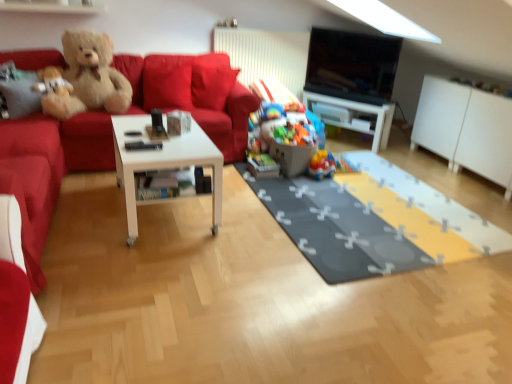
Describe the element at coordinates (466, 129) in the screenshot. I see `white matte cabinet at right` at that location.

Identify the location of velvet red couch at left. (57, 165).

Find the location of a particular element. matte red couch at left is located at coordinates (88, 142).

You are a GUI agent. You are given a task and a screenshot of the screen. Output one action in this format:
    pyautogui.click(x=<x>, y=<y>)
    Task: Click on the plastic colorful toys at center, marked as the second toy in a right-to-left arrangement
    Image resolution: width=512 pixels, height=384 pixels.
    Given the screenshot: What is the action you would take?
    pyautogui.click(x=293, y=147)

Identify the location of fluffy beige teddy bear at upper left, the 1th teddy bear in the left-to-right sequence. (57, 94).

What do you see at coordinates (374, 221) in the screenshot? I see `gray fabric mat at center` at bounding box center [374, 221].

Describe the element at coordinates (163, 163) in the screenshot. I see `white glossy coffee table at center` at that location.

Find the location of a particular element. The image size is (512, 384). white matte cabinet at right is located at coordinates (466, 129).

Considering the points (73, 143) and (42, 101), which point is behind, point (73, 143) or point (42, 101)?

Positioned behind is point (73, 143).

Which is more to the left, matte red couch at left or fluffy beige teddy bear at upper left, which is counted as the second teddy bear, starting from the right?

fluffy beige teddy bear at upper left, which is counted as the second teddy bear, starting from the right, is more to the left.

Is matte red couch at left oriented towards fluffy beige teddy bear at upper left, the 1th teddy bear in the left-to-right sequence?

No, matte red couch at left is not turned towards fluffy beige teddy bear at upper left, the 1th teddy bear in the left-to-right sequence.

Is fluffy beige teddy bear at upper left, which is counted as the second teddy bear, starting from the right, located within matte red couch at left?

Yes.

Considering the positions of objects white glossy coffee table at center and plastic colorful toys at center, marked as the second toy in a right-to-left arrangement, in the image provided, who is more to the right, white glossy coffee table at center or plastic colorful toys at center, marked as the second toy in a right-to-left arrangement,?

From the viewer's perspective, plastic colorful toys at center, marked as the second toy in a right-to-left arrangement, appears more on the right side.

From a real-world perspective, relative to plastic colorful toys at center, arranged as the second toy when viewed from the left, is white glossy coffee table at center vertically above or below?

Clearly, from a real-world perspective, white glossy coffee table at center is above plastic colorful toys at center, arranged as the second toy when viewed from the left.

Is white glossy coffee table at center in front of plastic colorful toys at center, arranged as the second toy when viewed from the left?

Yes, white glossy coffee table at center is in front of plastic colorful toys at center, arranged as the second toy when viewed from the left.

Between gray fabric mat at center and white glossy table at center, which one appears on the left side from the viewer's perspective?

gray fabric mat at center.

Is gray fabric mat at center aimed at white glossy table at center?

No, gray fabric mat at center does not turn towards white glossy table at center.

How much distance is there between gray fabric mat at center and white glossy table at center?

gray fabric mat at center is 4.48 feet from white glossy table at center.

From their relative heights in the image, would you say gray fabric mat at center is taller or shorter than white glossy table at center?

gray fabric mat at center is shorter than white glossy table at center.

Is fluffy brown teddy bear at left, marked as the second teddy bear in a left-to-right arrangement, completely or partially inside white glossy table at center?

No, fluffy brown teddy bear at left, marked as the second teddy bear in a left-to-right arrangement, is not surrounded by white glossy table at center.

Between white glossy table at center and fluffy brown teddy bear at left, marked as the second teddy bear in a left-to-right arrangement, which one is positioned in front?

fluffy brown teddy bear at left, marked as the second teddy bear in a left-to-right arrangement.

In terms of height, does white glossy table at center look taller or shorter compared to fluffy brown teddy bear at left, marked as the second teddy bear in a left-to-right arrangement?

In the image, white glossy table at center appears to be shorter than fluffy brown teddy bear at left, marked as the second teddy bear in a left-to-right arrangement.

Is white glossy table at center bigger or smaller than fluffy brown teddy bear at left, which is the 1th teddy bear in right-to-left order?

In the image, white glossy table at center appears to be smaller than fluffy brown teddy bear at left, which is the 1th teddy bear in right-to-left order.

Is fluffy beige teddy bear at upper left, the 1th teddy bear in the left-to-right sequence, next to white matte cabinet at right?

fluffy beige teddy bear at upper left, the 1th teddy bear in the left-to-right sequence, and white matte cabinet at right are not in contact.

Considering their positions, is fluffy beige teddy bear at upper left, the 1th teddy bear in the left-to-right sequence, located in front of or behind white matte cabinet at right?

fluffy beige teddy bear at upper left, the 1th teddy bear in the left-to-right sequence, is positioned closer to the viewer than white matte cabinet at right.

Considering the positions of objects fluffy beige teddy bear at upper left, which is counted as the second teddy bear, starting from the right, and white matte cabinet at right in the image provided, who is more to the left, fluffy beige teddy bear at upper left, which is counted as the second teddy bear, starting from the right, or white matte cabinet at right?

Positioned to the left is fluffy beige teddy bear at upper left, which is counted as the second teddy bear, starting from the right.

Can you confirm if fluffy beige teddy bear at upper left, which is counted as the second teddy bear, starting from the right, is wider than white matte cabinet at right?

No.

Considering the relative sizes of matte plastic toy at center, which ranks as the first toy in left-to-right order, and white matte cabinet at right in the image provided, is matte plastic toy at center, which ranks as the first toy in left-to-right order, shorter than white matte cabinet at right?

Yes, matte plastic toy at center, which ranks as the first toy in left-to-right order, is shorter than white matte cabinet at right.

Is matte plastic toy at center, which ranks as the 3th toy in right-to-left order, positioned with its back to white matte cabinet at right?

No, matte plastic toy at center, which ranks as the 3th toy in right-to-left order,'s orientation is not away from white matte cabinet at right.

Would you say matte plastic toy at center, which ranks as the first toy in left-to-right order, is inside or outside white matte cabinet at right?

matte plastic toy at center, which ranks as the first toy in left-to-right order, is not inside white matte cabinet at right, it's outside.

Is matte plastic toy at center, which ranks as the first toy in left-to-right order, positioned far away from white matte cabinet at right?

matte plastic toy at center, which ranks as the first toy in left-to-right order, is far away from white matte cabinet at right.

From the image's perspective, is black glossy tv at upper center located above fluffy beige teddy bear at upper left, the 1th teddy bear in the left-to-right sequence?

Correct, black glossy tv at upper center appears higher than fluffy beige teddy bear at upper left, the 1th teddy bear in the left-to-right sequence, in the image.

Considering the sizes of black glossy tv at upper center and fluffy beige teddy bear at upper left, the 1th teddy bear in the left-to-right sequence, in the image, is black glossy tv at upper center bigger or smaller than fluffy beige teddy bear at upper left, the 1th teddy bear in the left-to-right sequence,?

Clearly, black glossy tv at upper center is larger in size than fluffy beige teddy bear at upper left, the 1th teddy bear in the left-to-right sequence.

Measure the distance between black glossy tv at upper center and fluffy beige teddy bear at upper left, which is counted as the second teddy bear, starting from the right.

black glossy tv at upper center is 2.50 meters away from fluffy beige teddy bear at upper left, which is counted as the second teddy bear, starting from the right.

From a real-world perspective, is black glossy tv at upper center below fluffy beige teddy bear at upper left, which is counted as the second teddy bear, starting from the right?

No, from a real-world perspective, black glossy tv at upper center is not below fluffy beige teddy bear at upper left, which is counted as the second teddy bear, starting from the right.

This screenshot has height=384, width=512. Find the location of `couch lying in front of the fluffy beige teddy bear at upper left, the 1th teddy bear in the left-to-right sequence`. couch lying in front of the fluffy beige teddy bear at upper left, the 1th teddy bear in the left-to-right sequence is located at coordinates (88, 142).

Which toy is the 1st one when counting from the back of the white glossy coffee table at center? Please provide its 2D coordinates.

[(293, 147)]

Considering their positions, is fluffy beige teddy bear at upper left, the 1th teddy bear in the left-to-right sequence, positioned further to gray fabric mat at center than matte plastic toy at center, which ranks as the first toy in left-to-right order?

fluffy beige teddy bear at upper left, the 1th teddy bear in the left-to-right sequence, is positioned further to the anchor gray fabric mat at center.

Based on their spatial positions, is translucent plastic toy at center, which is counted as the third toy, starting from the left, or plastic colorful toys at center, arranged as the second toy when viewed from the left, further from fluffy beige teddy bear at upper left, the 1th teddy bear in the left-to-right sequence?

translucent plastic toy at center, which is counted as the third toy, starting from the left, lies further to fluffy beige teddy bear at upper left, the 1th teddy bear in the left-to-right sequence, than the other object.

Which object lies further to the anchor point plastic colorful toys at center, arranged as the second toy when viewed from the left, fluffy brown teddy bear at left, which is the 1th teddy bear in right-to-left order, or gray fabric mat at center?

Based on the image, fluffy brown teddy bear at left, which is the 1th teddy bear in right-to-left order, appears to be further to plastic colorful toys at center, arranged as the second toy when viewed from the left.

Based on their spatial positions, is matte plastic toy at center, which ranks as the 3th toy in right-to-left order, or black glossy tv at upper center closer to gray fabric mat at center?

Based on the image, matte plastic toy at center, which ranks as the 3th toy in right-to-left order, appears to be nearer to gray fabric mat at center.

Based on their spatial positions, is plastic colorful toys at center, arranged as the second toy when viewed from the left, or gray fabric mat at center closer to fluffy beige teddy bear at upper left, the 1th teddy bear in the left-to-right sequence?

plastic colorful toys at center, arranged as the second toy when viewed from the left.

From the image, which object appears to be farther from fluffy brown teddy bear at left, marked as the second teddy bear in a left-to-right arrangement, white glossy table at center or black glossy tv at upper center?

white glossy table at center.

When comparing their distances from matte red couch at left, does translucent plastic toy at center, the first toy in the right-to-left sequence, or fluffy brown teddy bear at left, which is the 1th teddy bear in right-to-left order, seem further?

fluffy brown teddy bear at left, which is the 1th teddy bear in right-to-left order, is positioned further to the anchor matte red couch at left.

Which object lies further to the anchor point fluffy brown teddy bear at left, marked as the second teddy bear in a left-to-right arrangement, black glossy tv at upper center or velvet red couch at left?

black glossy tv at upper center.

I want to click on couch situated between fluffy beige teddy bear at upper left, the 1th teddy bear in the left-to-right sequence, and white matte cabinet at right from left to right, so click(88, 142).

Image resolution: width=512 pixels, height=384 pixels. Find the location of `toy located between white glossy coffee table at center and translucent plastic toy at center, the first toy in the right-to-left sequence, in the depth direction`. toy located between white glossy coffee table at center and translucent plastic toy at center, the first toy in the right-to-left sequence, in the depth direction is located at coordinates (293, 147).

Where is `coffee table situated between fluffy brown teddy bear at left, marked as the second teddy bear in a left-to-right arrangement, and black glossy tv at upper center from left to right`? The image size is (512, 384). coffee table situated between fluffy brown teddy bear at left, marked as the second teddy bear in a left-to-right arrangement, and black glossy tv at upper center from left to right is located at coordinates (163, 163).

Find the location of a particular element. The height and width of the screenshot is (384, 512). coffee table between fluffy brown teddy bear at left, which is the 1th teddy bear in right-to-left order, and white matte cabinet at right is located at coordinates (163, 163).